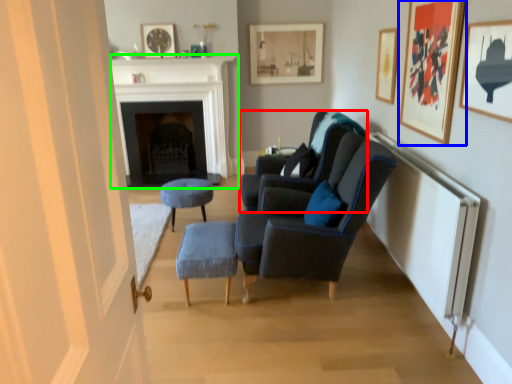
Question: Which is farther away from chair (highlighted by a red box)? picture frame (highlighted by a blue box) or fireplace (highlighted by a green box)?

Choices:
 (A) picture frame
 (B) fireplace

Answer: (B)